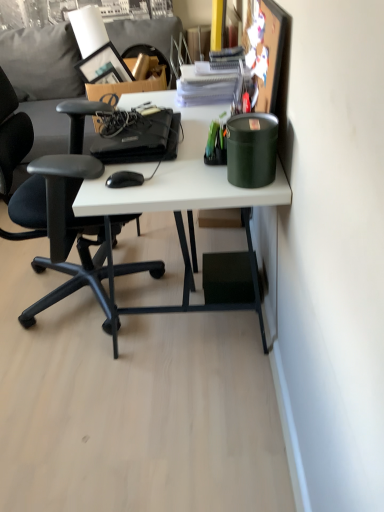
At what (x,y) coordinates should I click in order to perform the action: click on free space between black plastic mouse at center and green matte canister at upper right. Please return your answer as a coordinate pair (x, y). The height and width of the screenshot is (512, 384). Looking at the image, I should click on 187,179.